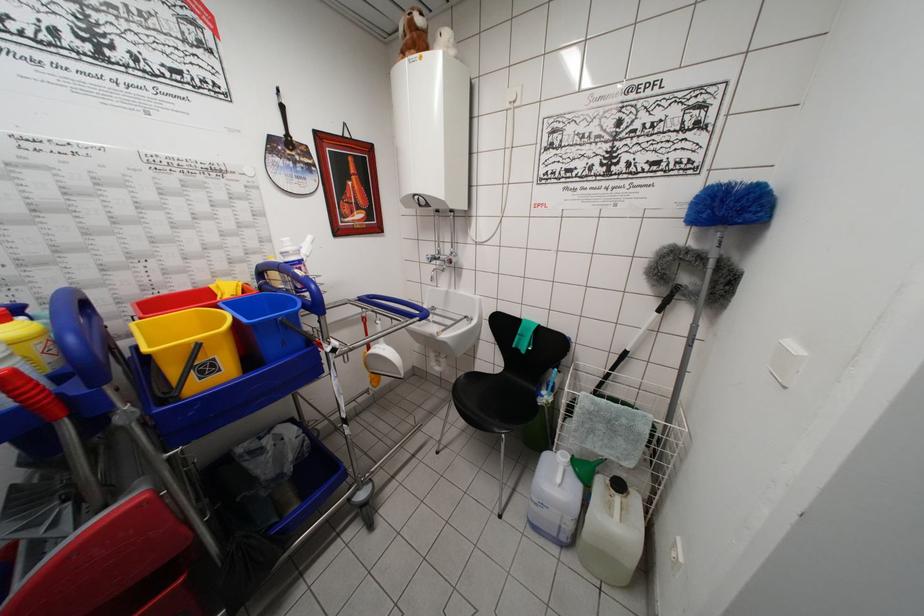
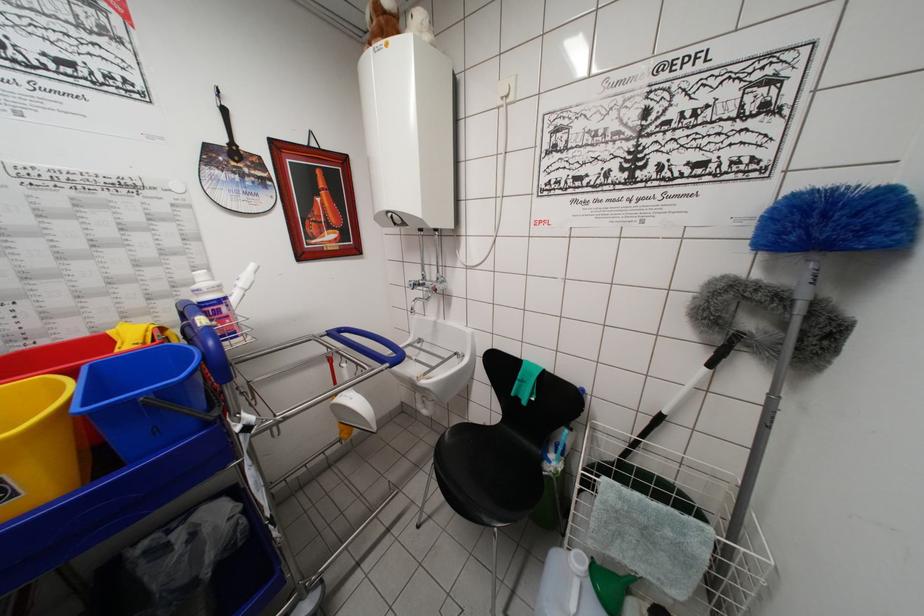
Find the pixel in the second image that matches the point at 456,264 in the first image.

(443, 292)